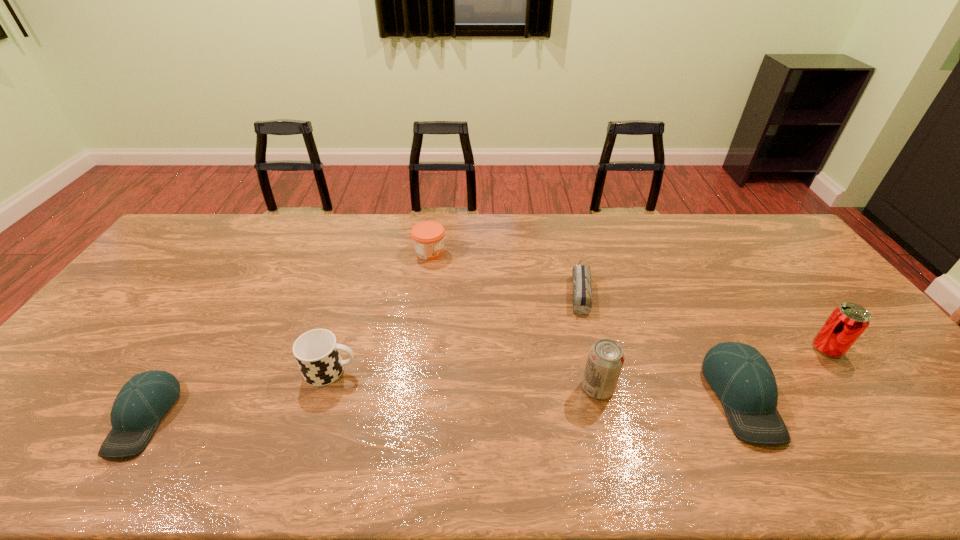
Find the location of `the left baseball cap`. the left baseball cap is located at coordinates (141, 403).

The image size is (960, 540). I want to click on the leftmost object, so click(x=141, y=403).

The image size is (960, 540). Find the location of `the right baseball cap`. the right baseball cap is located at coordinates (739, 374).

The image size is (960, 540). What are the coordinates of `the second object from right to left` in the screenshot? It's located at (739, 374).

Image resolution: width=960 pixels, height=540 pixels. What are the coordinates of `the fifth object from right to left` in the screenshot? It's located at pyautogui.click(x=428, y=236).

I want to click on the farthest object, so click(x=428, y=236).

Image resolution: width=960 pixels, height=540 pixels. Find the location of `pencil box`. pencil box is located at coordinates (582, 292).

Locate an element on the screen. The height and width of the screenshot is (540, 960). the shortest object is located at coordinates tap(582, 292).

Locate an element on the screen. This screenshot has height=540, width=960. the rightmost object is located at coordinates (847, 322).

I want to click on the farther soda can, so click(847, 322).